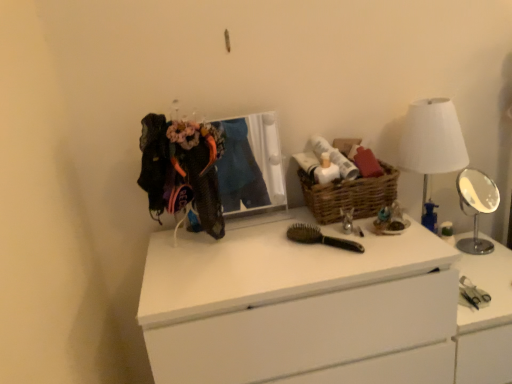
Where is `free spot above white matte chest of drawers at center (from a real-world perspective)`? The width and height of the screenshot is (512, 384). free spot above white matte chest of drawers at center (from a real-world perspective) is located at coordinates (263, 244).